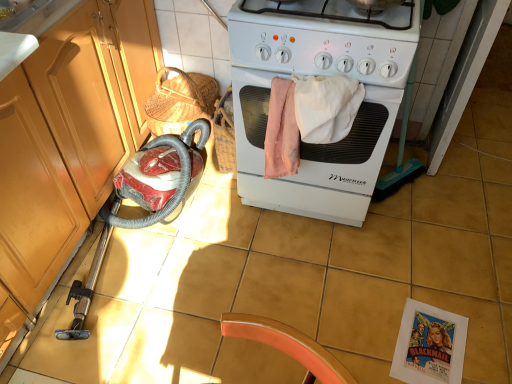
Question: Is point (311, 72) closer or farther from the camera than point (257, 147)?

Choices:
 (A) closer
 (B) farther

Answer: (A)

Question: Relative to white matte stove at center, is white glossy gas stove at center in front or behind?

Choices:
 (A) behind
 (B) front

Answer: (B)

Question: Estimate the real-world distances between objects in this image. Which object is farther from the white matte stove at center?

Choices:
 (A) white glossy gas stove at center
 (B) matte wood cabinet at left

Answer: (B)

Question: Estimate the real-world distances between objects in this image. Which object is farther from the matte wood cabinet at left?

Choices:
 (A) white glossy gas stove at center
 (B) white matte stove at center

Answer: (A)